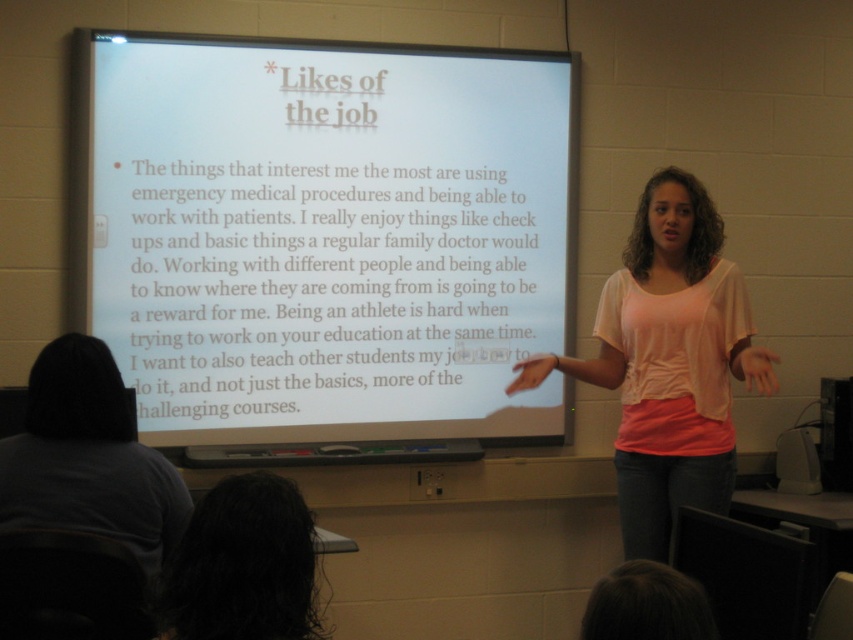
You are a student sitting in the front row of the classroom. You need to look at the white matte projector screen at upper center. Where should you direct your gaze?

You should direct your gaze to the upper center of the classroom where the white matte projector screen at upper center is located.

You are an attendee sitting in the front row of the classroom. You notice the pink cotton shirt at center and the dark curly hair at lower left. Which one appears closer to you?

The pink cotton shirt at center appears closer to you because it is further to the viewer than the dark curly hair at lower left.